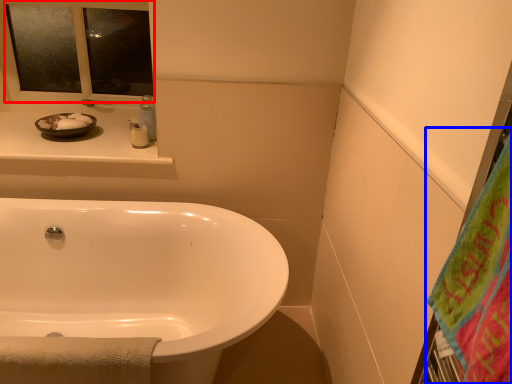
Question: Among these objects, which one is nearest to the camera, mirror (highlighted by a red box) or beach towel (highlighted by a blue box)?

Choices:
 (A) mirror
 (B) beach towel

Answer: (B)